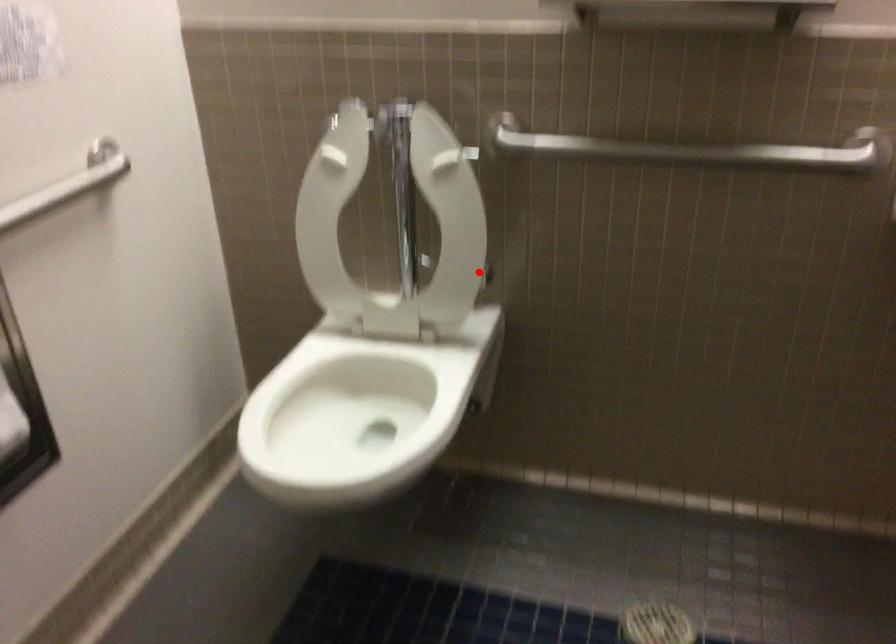
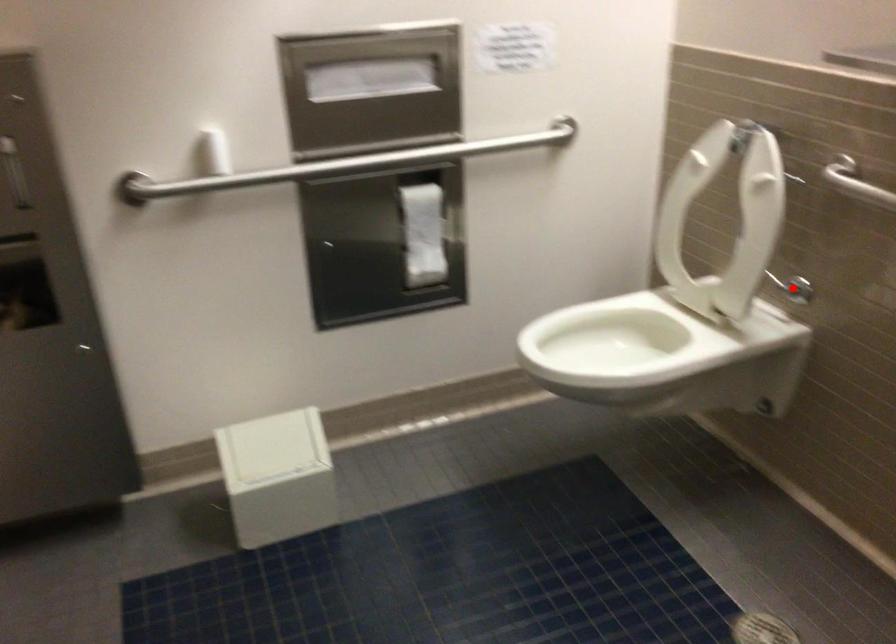
I am providing you with two images of the same scene from different viewpoints. A red point is marked on the first image and another point is marked on the second image. Does the point marked in image1 correspond to the same location as the one in image2?

Yes